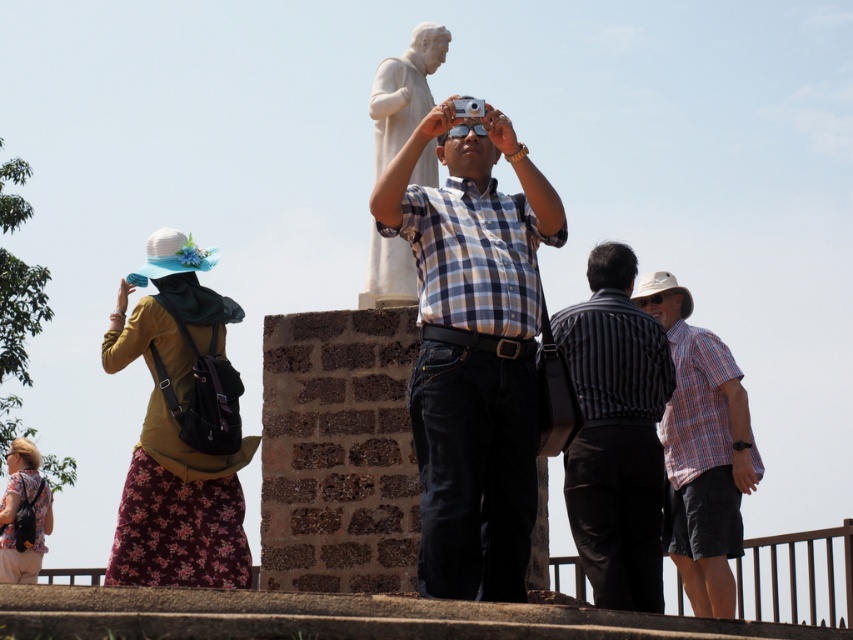
Between point (236, 580) and point (709, 589), which one is positioned in front?

Point (236, 580) is in front.

You are a GUI agent. You are given a task and a screenshot of the screen. Output one action in this format:
    pyautogui.click(x=<x>, y=<y>)
    Task: Click on the matte yellow shirt at upper left
    This screenshot has width=853, height=640.
    Given the screenshot: What is the action you would take?
    pyautogui.click(x=178, y=429)

Who is lower down, plaid shirt at center or white marble statue at center?

plaid shirt at center is below.

Does plaid shirt at center have a larger size compared to white marble statue at center?

Yes, plaid shirt at center is bigger than white marble statue at center.

Which is behind, point (717, 401) or point (378, 301)?

Positioned behind is point (717, 401).

At what (x,y) coordinates should I click in order to perform the action: click on plaid shirt at center. Please return your answer as a coordinate pair (x, y). Looking at the image, I should click on (701, 449).

Between checkered shirt at center and striped shirt at center, which one has less height?

Standing shorter between the two is striped shirt at center.

In the scene shown: Does checkered shirt at center appear on the left side of striped shirt at center?

Yes, checkered shirt at center is to the left of striped shirt at center.

Does point (445, 579) come behind point (642, 356)?

No, it is not.

This screenshot has height=640, width=853. In order to click on checkered shirt at center in this screenshot , I will do `click(473, 349)`.